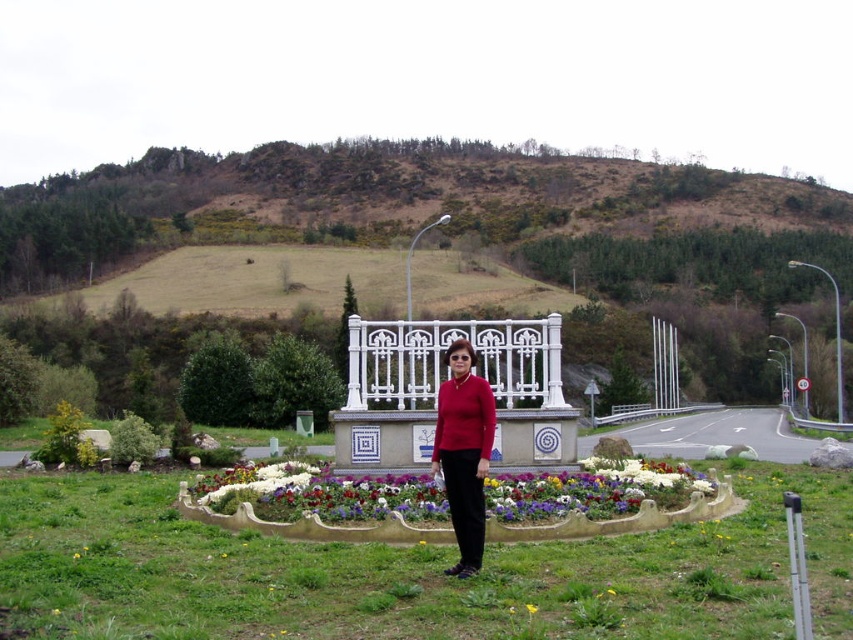
Where is `glossy concrete flower bed at center`? This screenshot has height=640, width=853. glossy concrete flower bed at center is located at coordinates click(312, 525).

Does glossy concrete flower bed at center appear on the left side of matte red sweater at center?

In fact, glossy concrete flower bed at center is to the right of matte red sweater at center.

Between point (234, 516) and point (492, 410), which one is positioned in front?

Point (492, 410)

In order to click on glossy concrete flower bed at center in this screenshot , I will do `click(312, 525)`.

Who is more forward, (781,241) or (492,518)?

Point (492,518)

Between brown grassy hillside at upper center and glossy concrete flower bed at center, which one appears on the left side from the viewer's perspective?

brown grassy hillside at upper center is more to the left.

Locate an element on the screen. This screenshot has width=853, height=640. brown grassy hillside at upper center is located at coordinates (469, 227).

Is brown grassy hillside at upper center smaller than yellow fabric flower at center?

No.

Can you confirm if brown grassy hillside at upper center is positioned to the left of yellow fabric flower at center?

Indeed, brown grassy hillside at upper center is positioned on the left side of yellow fabric flower at center.

Describe the element at coordinates (469, 227) in the screenshot. I see `brown grassy hillside at upper center` at that location.

Locate an element on the screen. Image resolution: width=853 pixels, height=640 pixels. brown grassy hillside at upper center is located at coordinates (469, 227).